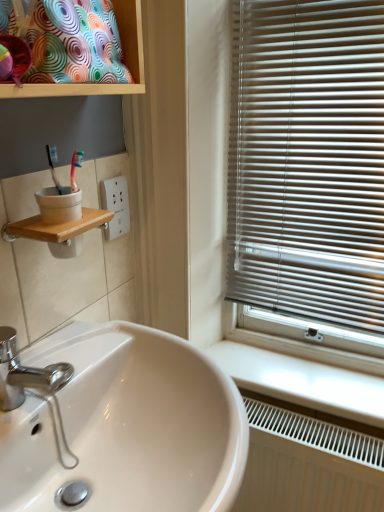
Question: Considering the relative sizes of white glossy sink at lower left and white glossy counter top at lower right in the image provided, is white glossy sink at lower left shorter than white glossy counter top at lower right?

Choices:
 (A) no
 (B) yes

Answer: (A)

Question: Does white glossy sink at lower left come in front of white glossy counter top at lower right?

Choices:
 (A) no
 (B) yes

Answer: (B)

Question: Does white glossy sink at lower left come behind white glossy counter top at lower right?

Choices:
 (A) no
 (B) yes

Answer: (A)

Question: From the image's perspective, is white glossy sink at lower left on top of white glossy counter top at lower right?

Choices:
 (A) yes
 (B) no

Answer: (B)

Question: Can you confirm if white glossy sink at lower left is positioned to the right of white glossy counter top at lower right?

Choices:
 (A) no
 (B) yes

Answer: (A)

Question: From a real-world perspective, relative to white textured radiator at lower right, is white glossy sink at lower left vertically above or below?

Choices:
 (A) below
 (B) above

Answer: (B)

Question: Considering the relative positions of white glossy sink at lower left and white textured radiator at lower right in the image provided, is white glossy sink at lower left to the left or to the right of white textured radiator at lower right?

Choices:
 (A) right
 (B) left

Answer: (B)

Question: From the image's perspective, is white glossy sink at lower left positioned above or below white textured radiator at lower right?

Choices:
 (A) below
 (B) above

Answer: (B)

Question: From their relative heights in the image, would you say white glossy sink at lower left is taller or shorter than white textured radiator at lower right?

Choices:
 (A) short
 (B) tall

Answer: (A)

Question: From the image's perspective, is white textured radiator at lower right located above or below white plastic socket at upper center?

Choices:
 (A) below
 (B) above

Answer: (A)

Question: Is white textured radiator at lower right situated inside white plastic socket at upper center or outside?

Choices:
 (A) outside
 (B) inside

Answer: (A)

Question: Looking at the image, does white textured radiator at lower right seem bigger or smaller compared to white plastic socket at upper center?

Choices:
 (A) big
 (B) small

Answer: (A)

Question: Relative to white plastic socket at upper center, is white textured radiator at lower right in front or behind?

Choices:
 (A) behind
 (B) front

Answer: (B)

Question: Considering the positions of multicolored fabric cushion at upper left and white plastic socket at upper center in the image, is multicolored fabric cushion at upper left taller or shorter than white plastic socket at upper center?

Choices:
 (A) tall
 (B) short

Answer: (A)

Question: Is multicolored fabric cushion at upper left inside the boundaries of white plastic socket at upper center, or outside?

Choices:
 (A) inside
 (B) outside

Answer: (B)